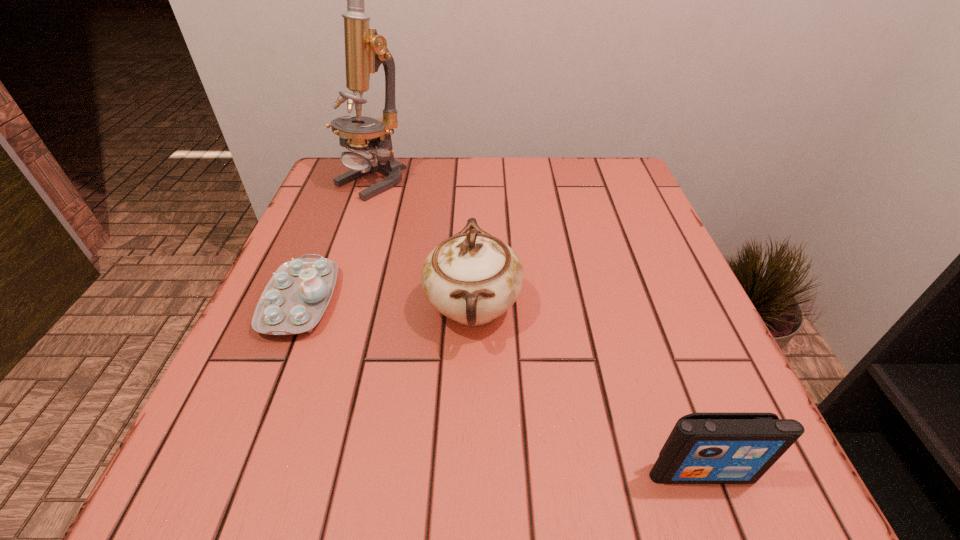
Image resolution: width=960 pixels, height=540 pixels. What are the coordinates of `vacant space at the left edge of the desktop` in the screenshot? It's located at (301, 245).

The width and height of the screenshot is (960, 540). I want to click on free location at the right edge, so click(x=645, y=320).

I want to click on vacant region at the far left corner, so click(x=310, y=207).

Locate an element on the screen. This screenshot has width=960, height=540. vacant area at the far right corner of the desktop is located at coordinates (626, 208).

At what (x,y) coordinates should I click in order to perform the action: click on vacant space in between the iPod and the second object from right to left. Please return your answer as a coordinate pair (x, y). Looking at the image, I should click on (x=588, y=390).

The height and width of the screenshot is (540, 960). What are the coordinates of `free space between the left chinaware and the second tallest object` in the screenshot? It's located at (387, 304).

This screenshot has width=960, height=540. I want to click on free space between the second object from right to left and the tallest object, so pyautogui.click(x=421, y=244).

I want to click on vacant space that's between the shorter chinaware and the farthest object, so tap(335, 241).

Locate an element on the screen. The height and width of the screenshot is (540, 960). free spot between the nearest object and the microscope is located at coordinates (536, 327).

Image resolution: width=960 pixels, height=540 pixels. I want to click on free space between the shortest object and the tallest object, so click(x=335, y=241).